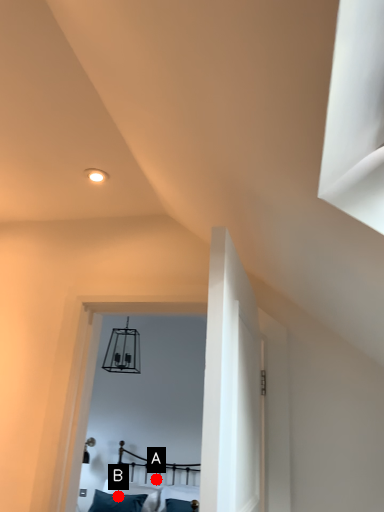
Question: Two points are circled on the image, labeled by A and B beside each circle. Which point appears farthest from the camera in this image?

Choices:
 (A) A is further
 (B) B is further

Answer: (A)